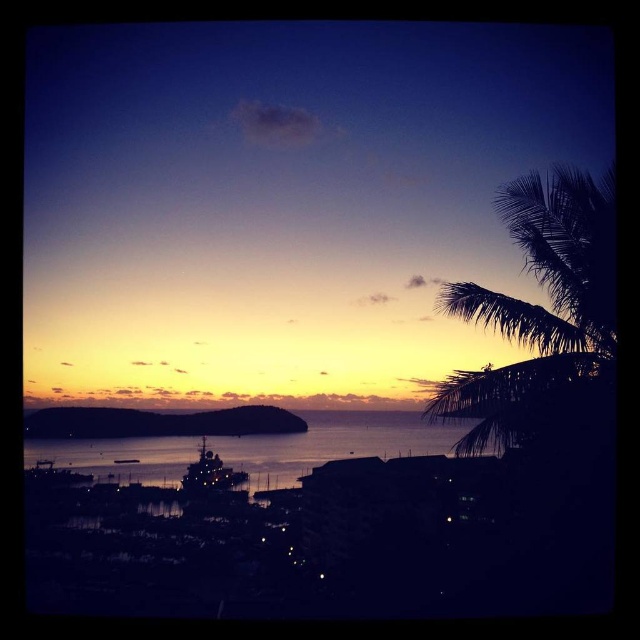
Question: Which point appears farthest from the camera in this image?

Choices:
 (A) (602, 248)
 (B) (180, 488)
 (C) (337, 452)

Answer: (C)

Question: Does glistening water at center appear under shiny metallic boat at center?

Choices:
 (A) no
 (B) yes

Answer: (A)

Question: Is glistening water at center to the left of shiny metallic boat at center from the viewer's perspective?

Choices:
 (A) no
 (B) yes

Answer: (A)

Question: Does glistening water at center have a smaller size compared to shiny metallic boat at center?

Choices:
 (A) no
 (B) yes

Answer: (A)

Question: Which object is closer to the camera taking this photo?

Choices:
 (A) glistening water at center
 (B) silhouette leafy palm at right

Answer: (B)

Question: Estimate the real-world distances between objects in this image. Which object is closer to the glistening water at center?

Choices:
 (A) silhouette leafy palm at right
 (B) shiny metallic boat at center

Answer: (B)